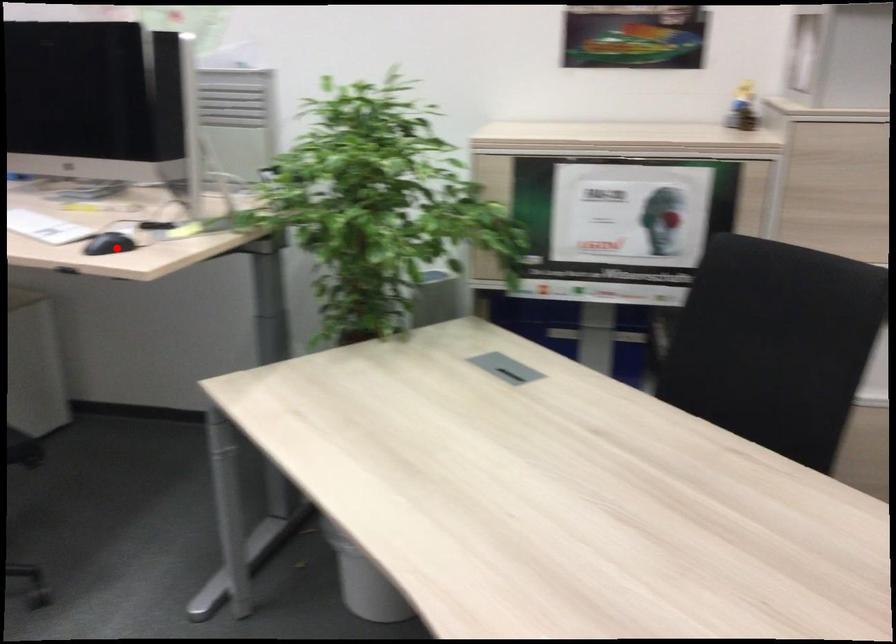
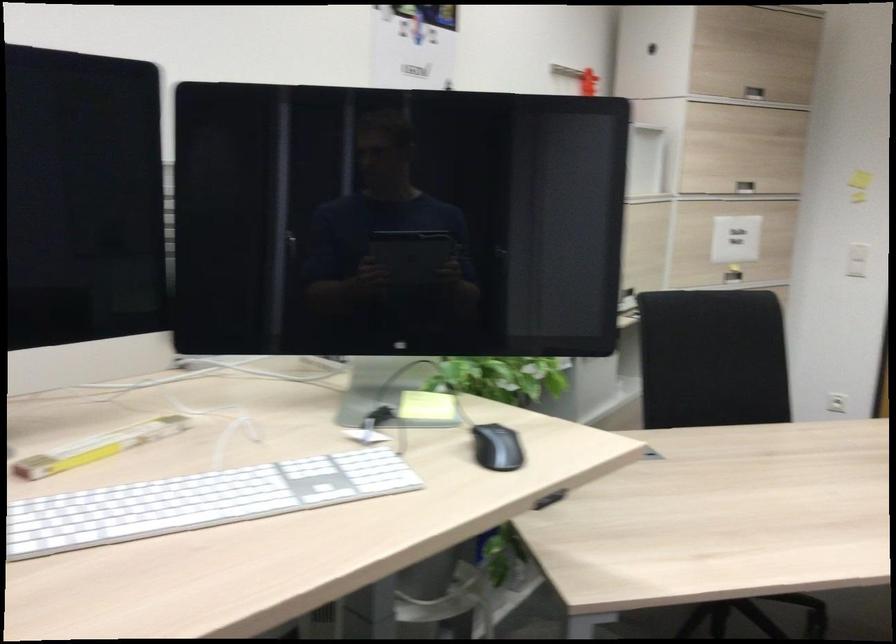
In the second image, find the point that corresponds to the highlighted location in the first image.

(496, 448)